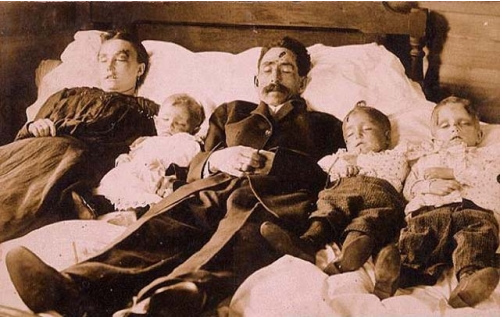
Locate an element on the screen. This screenshot has height=320, width=502. pillows is located at coordinates (187, 71), (355, 78).